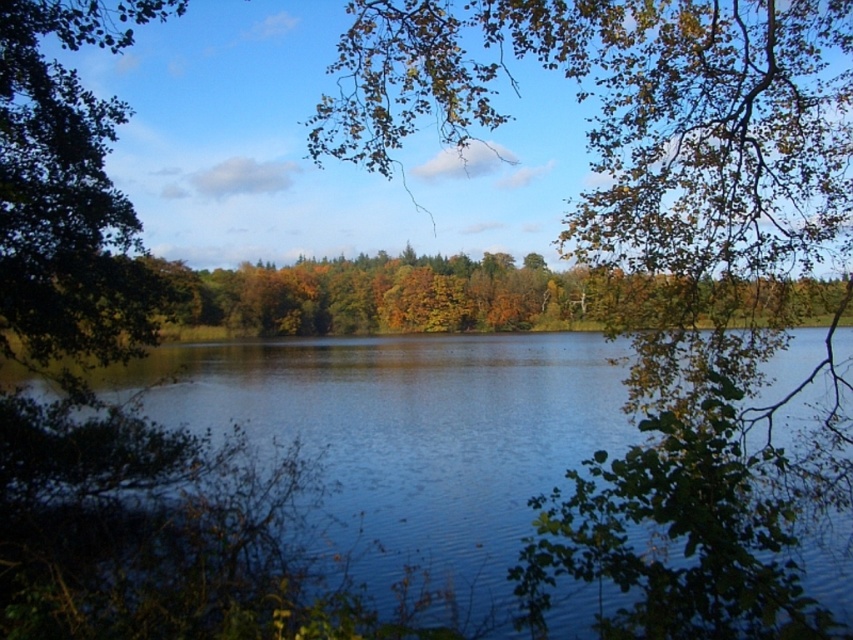
You are a photographer standing at the lakeside and want to capture both the blue liquid water at center and the green leafy tree at left in the same frame. Which object will appear larger in your photo?

The blue liquid water at center will appear larger in the photo because it is taller than the green leafy tree at left.

You are a photographer planning to capture the reflection of the green leafy tree at left in the blue liquid water at center. Based on the scene, can you determine if the reflection will be fully visible within the water?

The blue liquid water at center might be wider than green leafy tree at left, so the reflection of the green leafy tree at left may be fully visible within the blue liquid water at center if the water is wide enough to encompass the tree.

You are standing at the center of the lakeside and see two points marked on the image. The first point is at coordinates point (445, 355) and the second is at point (38, 353). If you walk towards the second point, will you encounter the first point before reaching the second one?

Point (445, 355) is behind point (38, 353), so if you walk towards the second point, you will reach the second point before encountering the first one.